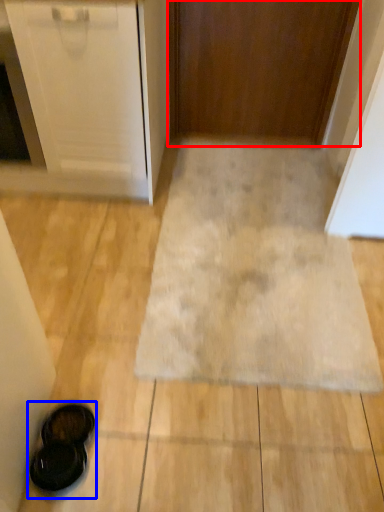
Question: Which point is further to the camera, door (highlighted by a red box) or footwear (highlighted by a blue box)?

Choices:
 (A) door
 (B) footwear

Answer: (A)